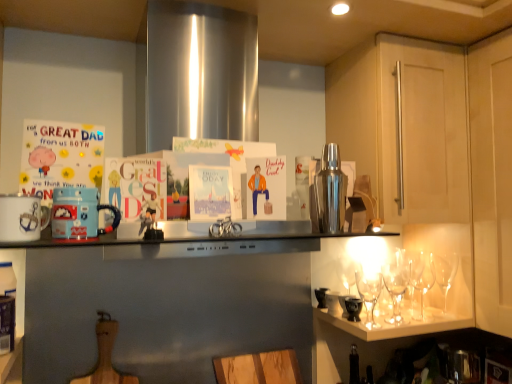
Question: Is shiny metallic cocktail shaker at upper right, the third appliance in the left-to-right sequence, to the right of wooden cutting board at lower center from the viewer's perspective?

Choices:
 (A) yes
 (B) no

Answer: (A)

Question: From the image's perspective, does shiny metallic cocktail shaker at upper right, the first appliance from the back, appear lower than wooden cutting board at lower center?

Choices:
 (A) yes
 (B) no

Answer: (B)

Question: Is shiny metallic cocktail shaker at upper right, the third appliance in the left-to-right sequence, positioned behind wooden cutting board at lower center?

Choices:
 (A) no
 (B) yes

Answer: (A)

Question: Is shiny metallic cocktail shaker at upper right, the third appliance in the left-to-right sequence, at the left side of wooden cutting board at lower center?

Choices:
 (A) no
 (B) yes

Answer: (A)

Question: Does shiny metallic cocktail shaker at upper right, the first appliance when ordered from right to left, have a lesser width compared to wooden cutting board at lower center?

Choices:
 (A) yes
 (B) no

Answer: (B)

Question: From a real-world perspective, is shiny metallic cocktail shaker at upper right, the third appliance in the left-to-right sequence, on top of wooden cutting board at lower center?

Choices:
 (A) yes
 (B) no

Answer: (A)

Question: Is white ceramic mug at left, which ranks as the 2th appliance in back-to-front order, at the left side of metallic silver countertop at center?

Choices:
 (A) yes
 (B) no

Answer: (A)

Question: Does white ceramic mug at left, which ranks as the 2th appliance in back-to-front order, lie in front of metallic silver countertop at center?

Choices:
 (A) no
 (B) yes

Answer: (A)

Question: Is white ceramic mug at left, which ranks as the 2th appliance in back-to-front order, surrounding metallic silver countertop at center?

Choices:
 (A) yes
 (B) no

Answer: (B)

Question: From a real-world perspective, is white ceramic mug at left, the third appliance positioned from the right, over metallic silver countertop at center?

Choices:
 (A) no
 (B) yes

Answer: (B)

Question: Is white ceramic mug at left, which is counted as the first appliance, starting from the left, not near metallic silver countertop at center?

Choices:
 (A) no
 (B) yes

Answer: (A)

Question: Is white ceramic mug at left, the third appliance positioned from the right, completely or partially outside of metallic silver countertop at center?

Choices:
 (A) yes
 (B) no

Answer: (B)

Question: From a real-world perspective, does matte cardboard postcard at left stand above white ceramic mug at left, which is counted as the first appliance, starting from the left?

Choices:
 (A) no
 (B) yes

Answer: (B)